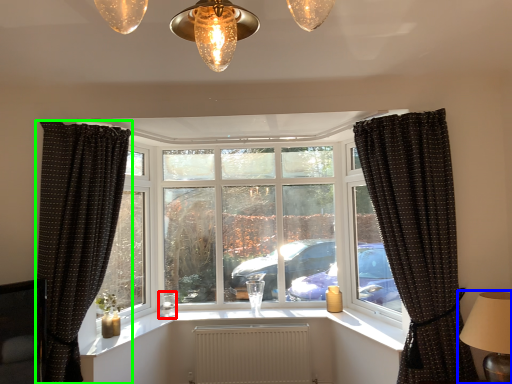
Question: Which is nearer to the candle holder (highlighted by a red box)? table lamp (highlighted by a blue box) or curtain (highlighted by a green box).

Choices:
 (A) table lamp
 (B) curtain

Answer: (B)